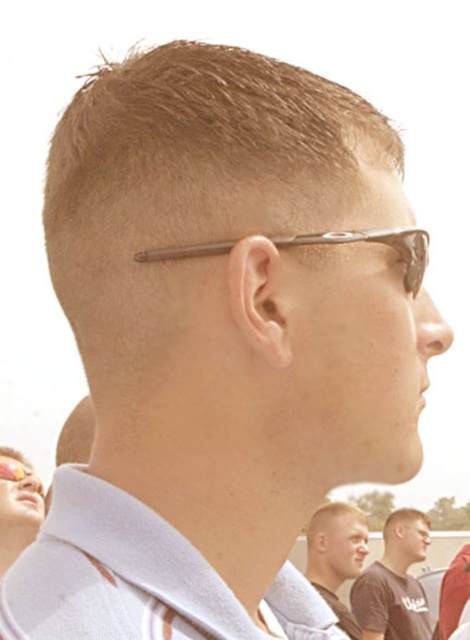
Question: Observing the image, what is the correct spatial positioning of dark brown t-shirt at center in reference to matte yellow sunglasses at upper left?

Choices:
 (A) right
 (B) left

Answer: (A)

Question: Is matte brown hair at center smaller than sunglasses at upper center?

Choices:
 (A) no
 (B) yes

Answer: (A)

Question: Considering the real-world distances, which object is closest to the matte yellow sunglasses at upper left?

Choices:
 (A) matte brown hair at upper left
 (B) brown matte hair at center
 (C) matte brown hair at center
 (D) matte brown sunglasses at upper center

Answer: (A)

Question: Which of the following is the closest to the observer?

Choices:
 (A) matte brown sunglasses at upper center
 (B) sunglasses at upper center

Answer: (A)

Question: Is brown matte hair at center positioned behind light brown hair at center?

Choices:
 (A) yes
 (B) no

Answer: (B)

Question: Which object is closer to the camera taking this photo?

Choices:
 (A) matte brown hair at upper left
 (B) matte yellow sunglasses at upper left
 (C) dark brown t-shirt at center

Answer: (A)